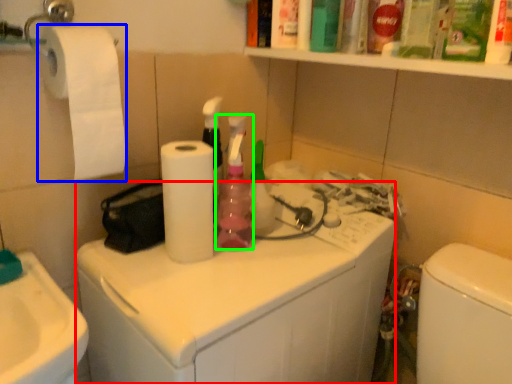
Question: Which object is the farthest from washing machine (highlighted by a red box)? Choose among these: toilet paper (highlighted by a blue box) or cleaning product (highlighted by a green box).

Choices:
 (A) toilet paper
 (B) cleaning product

Answer: (A)